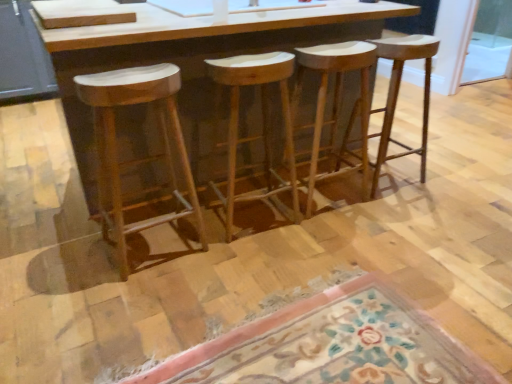
Where is `unoccupied area in front of natural wood stool at center, the fourth stool viewed from the left`? This screenshot has height=384, width=512. unoccupied area in front of natural wood stool at center, the fourth stool viewed from the left is located at coordinates (397, 210).